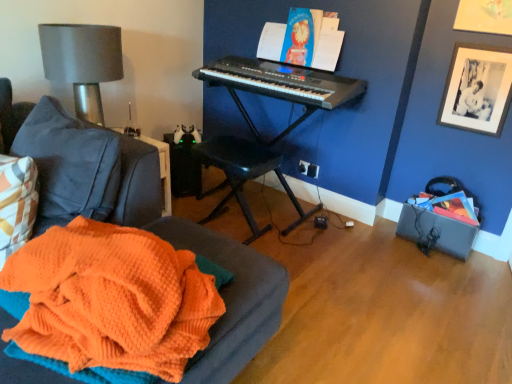
Where is `vacant space underneath black plastic music stool at center (from a real-world perspective)`? vacant space underneath black plastic music stool at center (from a real-world perspective) is located at coordinates (233, 228).